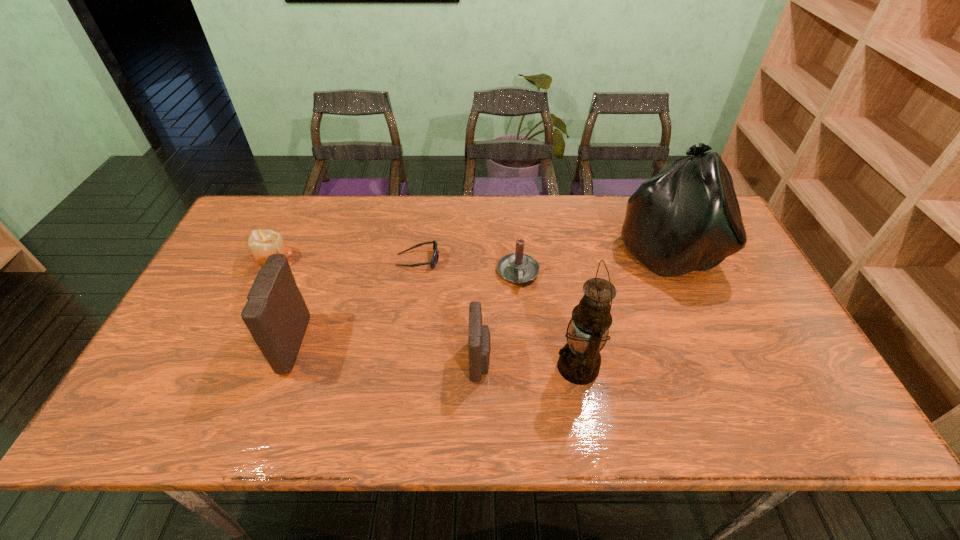
Where is `vacant place for an extra pouch on the right`? This screenshot has height=540, width=960. vacant place for an extra pouch on the right is located at coordinates (685, 379).